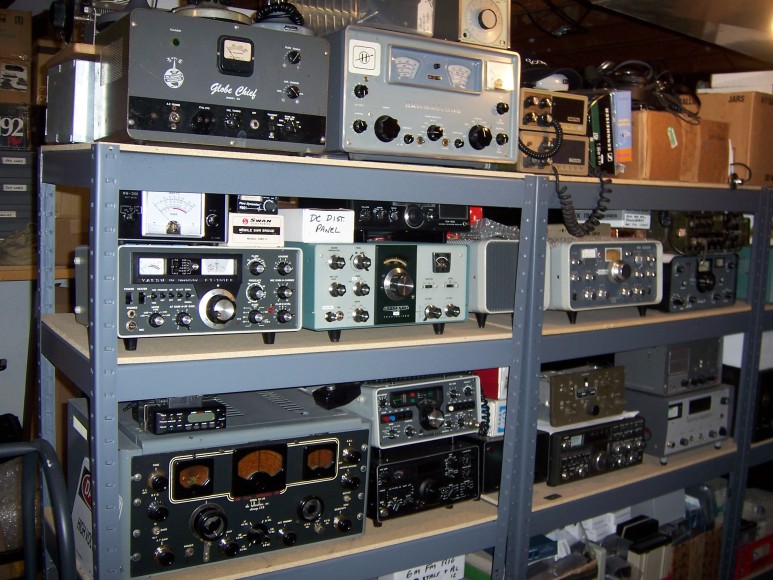
Identify the location of brown card board box. (652, 150), (692, 148), (751, 142).